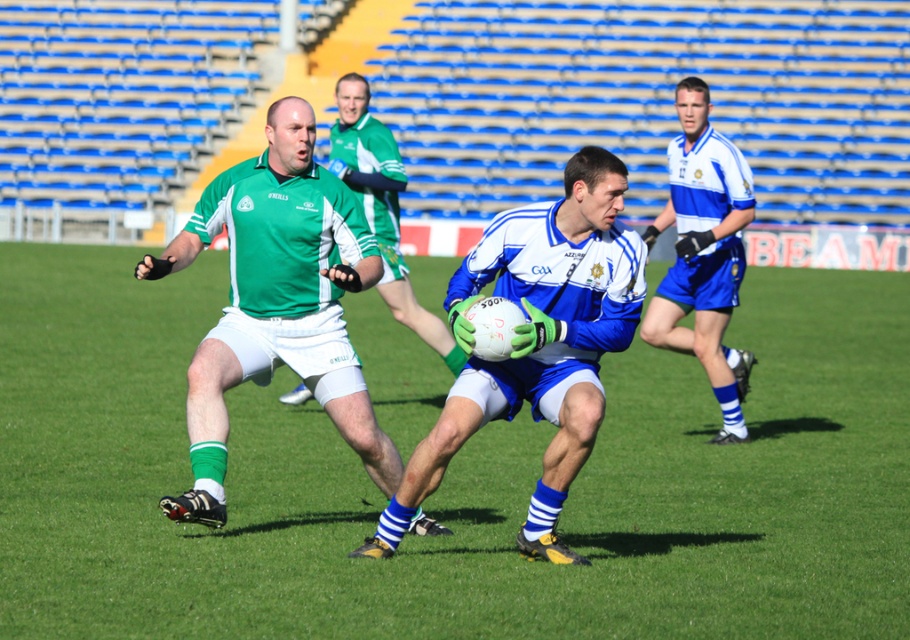
You are a referee in the Gaelic football match. You need to determine which of the two points, point (x=595, y=237) or point (x=739, y=170), is closer to the camera. Based on the image, which point is closer?

Point (x=595, y=237) is closer to the viewer than point (x=739, y=170).

You are a referee observing the Gaelic football match. You need to determine the position of the two players wearing green jerseys. Which player, the green jersey at left or the green jersey at center, is positioned lower on the field?

The green jersey at left is located below the green jersey at center, meaning the green jersey at left is positioned lower on the field.